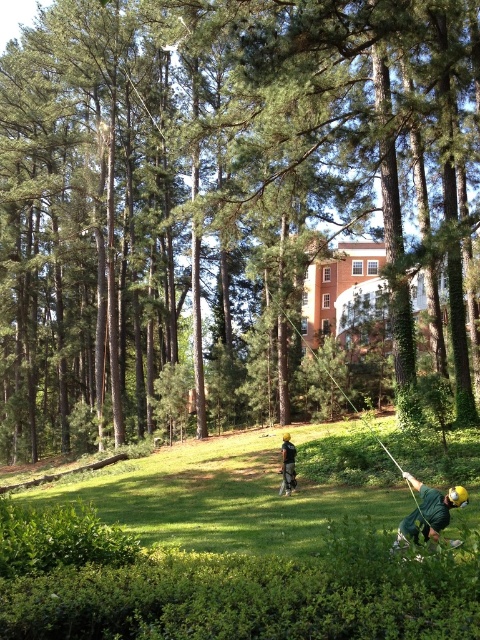
Question: Is green leafy tree at center below green grassy at lower center?

Choices:
 (A) no
 (B) yes

Answer: (A)

Question: Which of these objects is positioned farthest from the green grassy at lower center?

Choices:
 (A) green matte helmet at center
 (B) dark green fabric shirt at center

Answer: (A)

Question: Does green leafy tree at center appear over green matte helmet at center?

Choices:
 (A) no
 (B) yes

Answer: (B)

Question: Which object appears farthest from the camera in this image?

Choices:
 (A) green leafy tree at center
 (B) green grassy at lower center
 (C) dark green fabric shirt at center
 (D) green matte helmet at center

Answer: (A)

Question: Does green grassy at lower center have a larger size compared to green matte helmet at center?

Choices:
 (A) no
 (B) yes

Answer: (B)

Question: Which of the following is the closest to the observer?

Choices:
 (A) green grassy at lower center
 (B) dark green fabric shirt at center
 (C) green matte helmet at center
 (D) green leafy tree at center

Answer: (C)